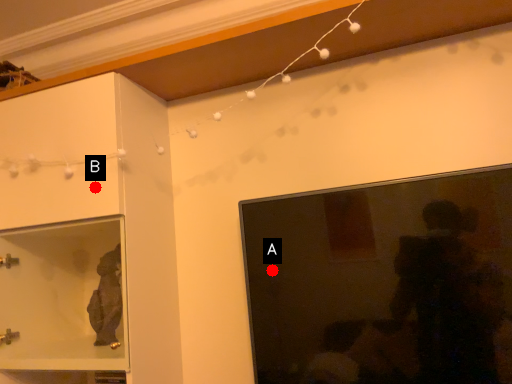
Question: Two points are circled on the image, labeled by A and B beside each circle. Which point is closer to the camera?

Choices:
 (A) A is closer
 (B) B is closer

Answer: (B)